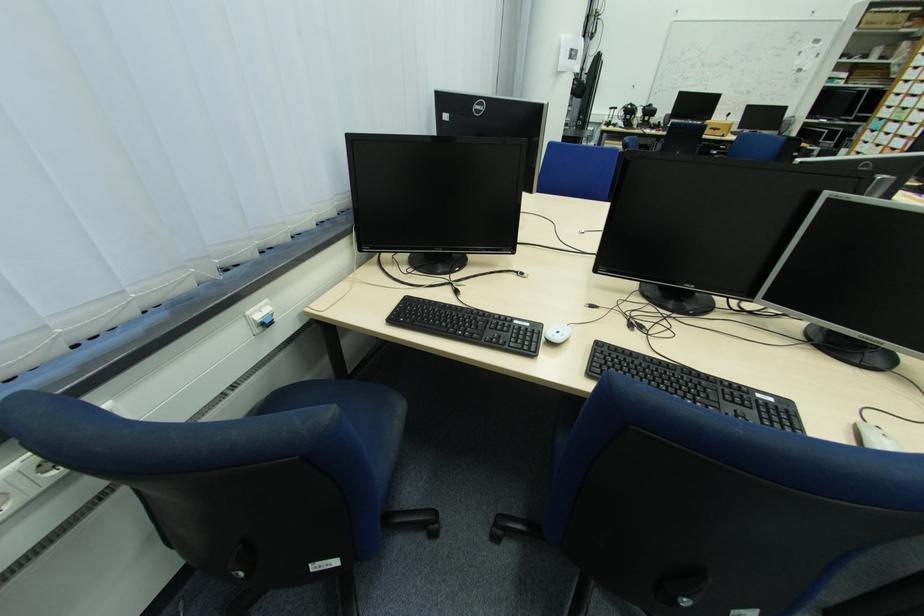
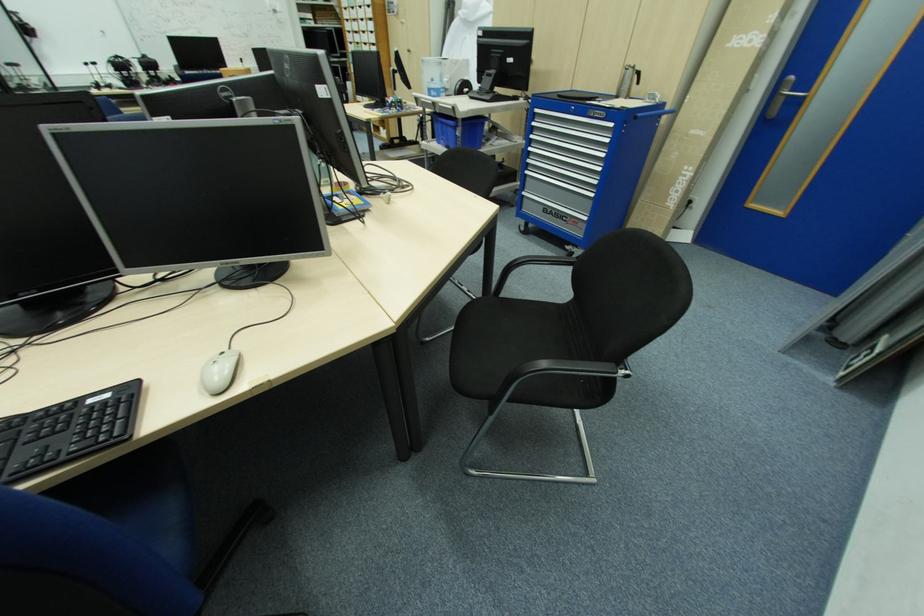
Based on the continuous images, in which direction is the camera rotating?

The camera's rotation is toward right-down.